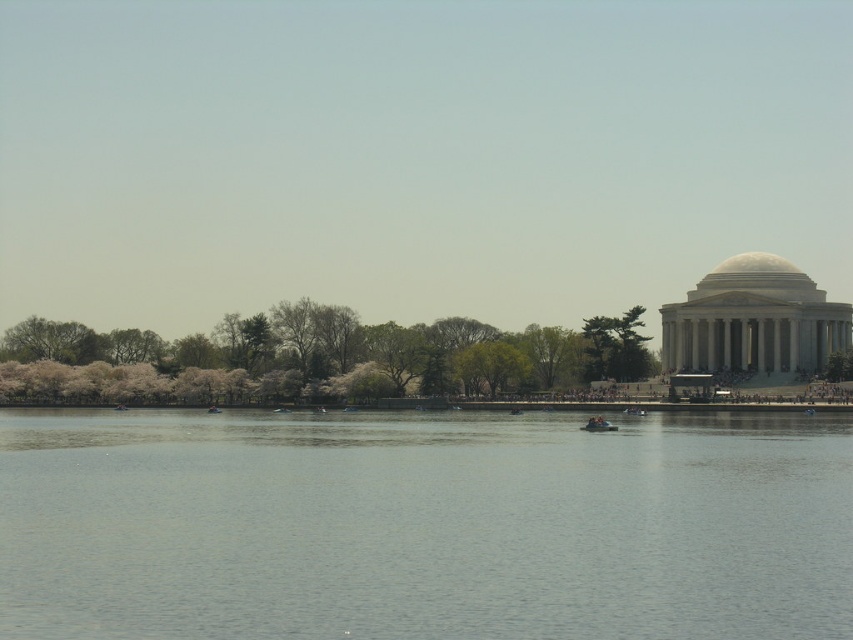
Is fluffy white blossoms at center in front of green leafy tree at center?

Yes, it is.

Is fluffy white blossoms at center shorter than green leafy tree at center?

Incorrect, fluffy white blossoms at center's height does not fall short of green leafy tree at center's.

Describe the element at coordinates (314, 358) in the screenshot. The image size is (853, 640). I see `fluffy white blossoms at center` at that location.

Find the location of a particular element. Image resolution: width=853 pixels, height=640 pixels. fluffy white blossoms at center is located at coordinates (314, 358).

Is green leafy tree at center thinner than matte orange boat at center?

Yes.

Can you confirm if green leafy tree at center is positioned to the left of matte orange boat at center?

In fact, green leafy tree at center is to the right of matte orange boat at center.

This screenshot has width=853, height=640. I want to click on green leafy tree at center, so click(614, 346).

Image resolution: width=853 pixels, height=640 pixels. I want to click on green leafy tree at center, so click(614, 346).

How distant is gray water at center from fluffy white blossoms at center?

gray water at center and fluffy white blossoms at center are 120.70 feet apart from each other.

Is gray water at center wider than fluffy white blossoms at center?

No.

Is point (502, 417) more distant than point (506, 348)?

No, (502, 417) is closer to viewer.

The image size is (853, 640). In order to click on gray water at center in this screenshot , I will do `click(422, 525)`.